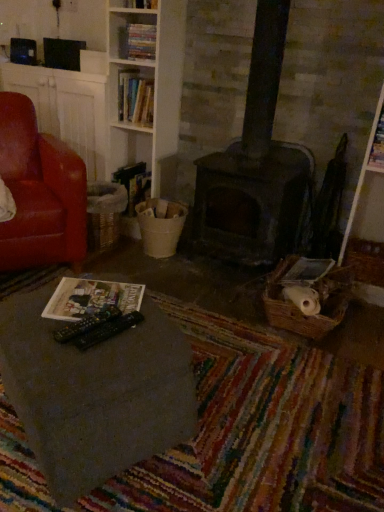
The height and width of the screenshot is (512, 384). What do you see at coordinates (91, 298) in the screenshot? I see `matte paper magazine at lower left, positioned as the second magazine in top-to-bottom order` at bounding box center [91, 298].

The height and width of the screenshot is (512, 384). What do you see at coordinates (95, 393) in the screenshot?
I see `smooth gray table at lower left` at bounding box center [95, 393].

Describe the element at coordinates (250, 202) in the screenshot. I see `dark gray stone fireplace at center` at that location.

Find the location of a particular element. matte paper magazine at lower left, the 1th magazine ordered from the bottom is located at coordinates (91, 298).

Does dark gray stone fireplace at center have a lesser width compared to smooth gray table at lower left?

Correct, the width of dark gray stone fireplace at center is less than that of smooth gray table at lower left.

Is dark gray stone fireplace at center smaller than smooth gray table at lower left?

Indeed, dark gray stone fireplace at center has a smaller size compared to smooth gray table at lower left.

Is dark gray stone fireplace at center positioned with its back to smooth gray table at lower left?

No.

What's the angular difference between dark gray stone fireplace at center and smooth gray table at lower left's facing directions?

The angle between the facing direction of dark gray stone fireplace at center and the facing direction of smooth gray table at lower left is 28.4 degrees.

From the image's perspective, between matte paper magazine at lower left, positioned as the second magazine in top-to-bottom order, and smooth gray table at lower left, which one is located above?

matte paper magazine at lower left, positioned as the second magazine in top-to-bottom order, is shown above in the image.

Can you confirm if matte paper magazine at lower left, which appears as the 1th magazine when viewed from the front, is thinner than smooth gray table at lower left?

Yes.

From a real-world perspective, relative to smooth gray table at lower left, is matte paper magazine at lower left, the 1th magazine ordered from the bottom, vertically above or below?

matte paper magazine at lower left, the 1th magazine ordered from the bottom, is situated higher than smooth gray table at lower left in the real world.

Is matte paper magazine at lower left, which appears as the 1th magazine when viewed from the front, far from smooth gray table at lower left?

No, matte paper magazine at lower left, which appears as the 1th magazine when viewed from the front, is not far from smooth gray table at lower left.

Between point (382, 150) and point (126, 42), which one is positioned in front?

The point (382, 150) is closer to the camera.

Based on the photo, from a real-world perspective, is matte paper magazine at upper right, the first magazine when ordered from top to bottom, located beneath hardcover books at upper center, positioned as the 1th book in top-to-bottom order?

Correct, in the physical world, matte paper magazine at upper right, the first magazine when ordered from top to bottom, is lower than hardcover books at upper center, positioned as the 1th book in top-to-bottom order.

Is matte paper magazine at upper right, which is the second magazine in left-to-right order, not inside hardcover books at upper center, positioned as the 1th book in top-to-bottom order?

Yes, matte paper magazine at upper right, which is the second magazine in left-to-right order, is not within hardcover books at upper center, positioned as the 1th book in top-to-bottom order.

Who is shorter, matte paper magazine at upper right, the 1th magazine in the right-to-left sequence, or hardcover books at upper center, the 3th book positioned from the bottom?

hardcover books at upper center, the 3th book positioned from the bottom.

Does matte paper magazine at upper right, the first magazine when ordered from top to bottom, touch dark gray stone fireplace at center?

No, matte paper magazine at upper right, the first magazine when ordered from top to bottom, is not in contact with dark gray stone fireplace at center.

Is matte paper magazine at upper right, which is the 1th magazine from back to front, completely or partially outside of dark gray stone fireplace at center?

Yes, matte paper magazine at upper right, which is the 1th magazine from back to front, is outside of dark gray stone fireplace at center.

Based on their sizes in the image, would you say matte paper magazine at upper right, the first magazine when ordered from top to bottom, is bigger or smaller than dark gray stone fireplace at center?

matte paper magazine at upper right, the first magazine when ordered from top to bottom, is smaller than dark gray stone fireplace at center.

From the image's perspective, is matte paper magazine at upper right, which is the second magazine in left-to-right order, located above or below dark gray stone fireplace at center?

Based on their image positions, matte paper magazine at upper right, which is the second magazine in left-to-right order, is located above dark gray stone fireplace at center.

Could you tell me if leather at left is turned towards hardcover book at upper center, the second book in the bottom-to-top sequence?

No, leather at left is not oriented towards hardcover book at upper center, the second book in the bottom-to-top sequence.

Between leather at left and hardcover book at upper center, which is the second book in top-to-bottom order, which one appears on the right side from the viewer's perspective?

hardcover book at upper center, which is the second book in top-to-bottom order, is more to the right.

Which point is more forward, (x=56, y=156) or (x=119, y=94)?

Point (x=56, y=156)

Is leather at left inside or outside of hardcover book at upper center, which is the second book in top-to-bottom order?

leather at left is not enclosed by hardcover book at upper center, which is the second book in top-to-bottom order.

Is matte paper magazine at lower left, positioned as the first magazine in left-to-right order, to the right of hardcover books at upper center, positioned as the 1th book in top-to-bottom order, from the viewer's perspective?

Incorrect, matte paper magazine at lower left, positioned as the first magazine in left-to-right order, is not on the right side of hardcover books at upper center, positioned as the 1th book in top-to-bottom order.

Identify the location of magazine that is the 2nd one when counting downward from the hardcover books at upper center, the 3th book positioned from the bottom (from the image's perspective). This screenshot has width=384, height=512. (91, 298).

Does point (70, 302) appear closer or farther from the camera than point (153, 52)?

Point (70, 302) appears to be closer to the viewer than point (153, 52).

From the image's perspective, is matte paper magazine at lower left, positioned as the second magazine in top-to-bottom order, above or below hardcover books at upper center, the 3th book positioned from the bottom?

Clearly, from the image's perspective, matte paper magazine at lower left, positioned as the second magazine in top-to-bottom order, is below hardcover books at upper center, the 3th book positioned from the bottom.

From a real-world perspective, is hardcover book at center, placed as the third book when sorted from top to bottom, physically below dark gray stone fireplace at center?

Yes, from a real-world perspective, hardcover book at center, placed as the third book when sorted from top to bottom, is below dark gray stone fireplace at center.

Is hardcover book at center, placed as the third book when sorted from top to bottom, taller or shorter than dark gray stone fireplace at center?

Considering their sizes, hardcover book at center, placed as the third book when sorted from top to bottom, has less height than dark gray stone fireplace at center.

Is dark gray stone fireplace at center a part of hardcover book at center, placed as the third book when sorted from top to bottom?

That's incorrect, dark gray stone fireplace at center is not inside hardcover book at center, placed as the third book when sorted from top to bottom.

Between point (135, 193) and point (288, 238), which one is positioned in front?

The point (288, 238) is closer.

Find the location of `fireplace above the smooth gray table at lower left (from the image's perspective)`. fireplace above the smooth gray table at lower left (from the image's perspective) is located at coordinates (250, 202).

Which magazine is the 1st one when counting from the back of the smooth gray table at lower left? Please provide its 2D coordinates.

[(91, 298)]

Which object lies nearer to the anchor point dark gray stone fireplace at center, matte paper magazine at upper right, the 2th magazine positioned from the bottom, or hardcover book at upper center, which is the second book in top-to-bottom order?

The object closer to dark gray stone fireplace at center is matte paper magazine at upper right, the 2th magazine positioned from the bottom.

From the image, which object appears to be nearer to hardcover book at center, placed as the 1th book when sorted from bottom to top, smooth gray table at lower left or matte paper magazine at lower left, positioned as the second magazine in top-to-bottom order?

matte paper magazine at lower left, positioned as the second magazine in top-to-bottom order, is closer to hardcover book at center, placed as the 1th book when sorted from bottom to top.

Looking at this image, from the image, which object appears to be nearer to matte paper magazine at lower left, positioned as the second magazine in top-to-bottom order, matte paper magazine at upper right, the first magazine when ordered from top to bottom, or hardcover book at upper center, the second book in the bottom-to-top sequence?

The object closer to matte paper magazine at lower left, positioned as the second magazine in top-to-bottom order, is hardcover book at upper center, the second book in the bottom-to-top sequence.

Looking at the image, which one is located closer to hardcover book at upper center, which is the second book in top-to-bottom order, hardcover books at upper center, the 3th book positioned from the bottom, or smooth gray table at lower left?

Based on the image, hardcover books at upper center, the 3th book positioned from the bottom, appears to be nearer to hardcover book at upper center, which is the second book in top-to-bottom order.

When comparing their distances from matte paper magazine at upper right, the 2th magazine positioned from the bottom, does leather at left or matte paper magazine at lower left, which ranks as the second magazine in back-to-front order, seem further?

The object further to matte paper magazine at upper right, the 2th magazine positioned from the bottom, is leather at left.

Based on their spatial positions, is matte paper magazine at upper right, which is the second magazine in left-to-right order, or matte paper magazine at lower left, acting as the second magazine starting from the right, further from hardcover books at upper center, the 3th book positioned from the bottom?

Answer: matte paper magazine at lower left, acting as the second magazine starting from the right, is further to hardcover books at upper center, the 3th book positioned from the bottom.

Looking at the image, which one is located closer to leather at left, matte paper magazine at upper right, the 2th magazine positioned from the bottom, or smooth gray table at lower left?

Among the two, smooth gray table at lower left is located nearer to leather at left.

When comparing their distances from matte paper magazine at upper right, which is the 1th magazine from back to front, does hardcover book at upper center, which is the second book in top-to-bottom order, or matte paper magazine at lower left, positioned as the second magazine in top-to-bottom order, seem closer?

hardcover book at upper center, which is the second book in top-to-bottom order, lies closer to matte paper magazine at upper right, which is the 1th magazine from back to front, than the other object.

Where is `book located between hardcover book at upper center, the second book in the bottom-to-top sequence, and matte paper magazine at upper right, the 2th magazine positioned from the bottom, in the left-right direction`? The width and height of the screenshot is (384, 512). book located between hardcover book at upper center, the second book in the bottom-to-top sequence, and matte paper magazine at upper right, the 2th magazine positioned from the bottom, in the left-right direction is located at coordinates (141, 41).

Identify the location of fireplace situated between hardcover book at center, placed as the third book when sorted from top to bottom, and matte paper magazine at upper right, which is the second magazine in left-to-right order, from left to right. Image resolution: width=384 pixels, height=512 pixels. (250, 202).

This screenshot has height=512, width=384. Find the location of `chair between smooth gray table at lower left and hardcover book at upper center, the second book in the bottom-to-top sequence, along the z-axis`. chair between smooth gray table at lower left and hardcover book at upper center, the second book in the bottom-to-top sequence, along the z-axis is located at coordinates (39, 191).

Where is `fireplace between matte paper magazine at lower left, positioned as the first magazine in left-to-right order, and hardcover book at center, placed as the 1th book when sorted from bottom to top, from front to back`? The height and width of the screenshot is (512, 384). fireplace between matte paper magazine at lower left, positioned as the first magazine in left-to-right order, and hardcover book at center, placed as the 1th book when sorted from bottom to top, from front to back is located at coordinates (x=250, y=202).